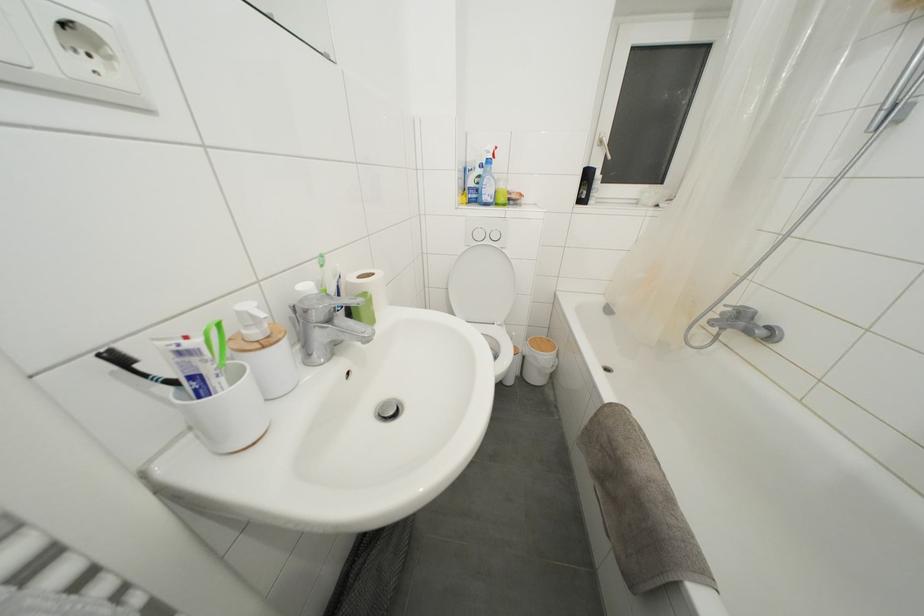
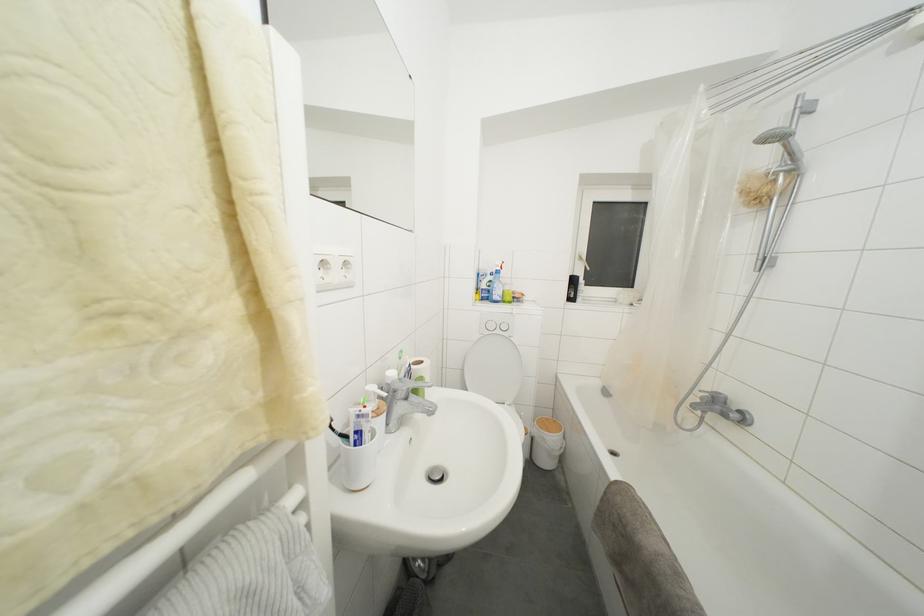
In the second image, find the point that corresponds to point 517,206 in the first image.

(520, 304)